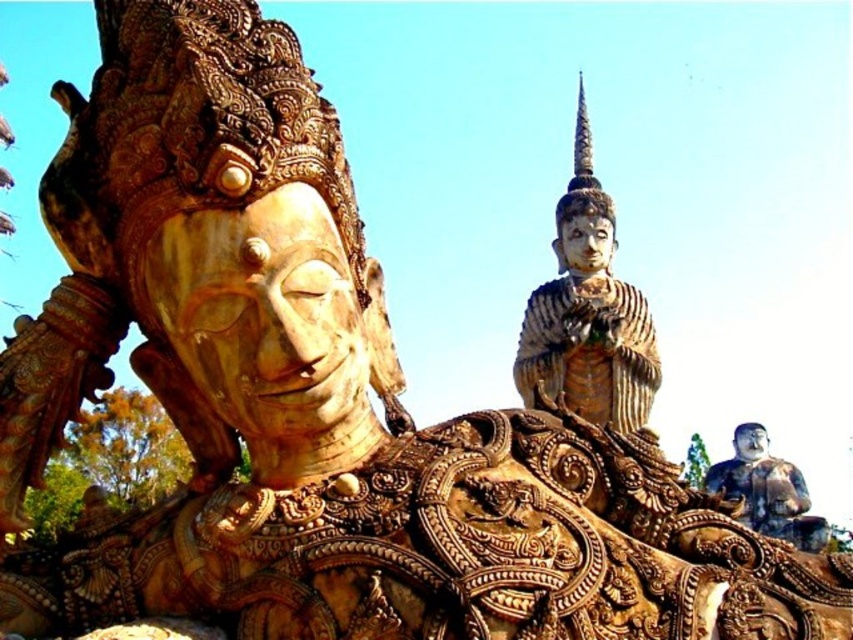
Looking at this image, you are an art conservator examining the golden statue at the center of the image. You notice a specific point at coordinates (x=587, y=314). Based on the statue description, can you determine what part of the statue this point is located on?

The point at coordinates (x=587, y=314) is located on the gold textured statue at center, which has intricate carvings and a serene expression.

You are an art conservator examining the image. You need to document the exact location of the gold textured statue at center. What are its coordinates?

The gold textured statue at center is located at coordinates point (587,314).

You are an art conservator examining the statues in the image. You need to clean the gold textured statue at center and the polished bronze statue at lower right. Which statue should you start with to minimize the risk of accidentally touching the other one?

You should start with the gold textured statue at center because it is closer to you than the polished bronze statue at lower right, so cleaning it first reduces the chance of accidentally touching the other statue behind it.